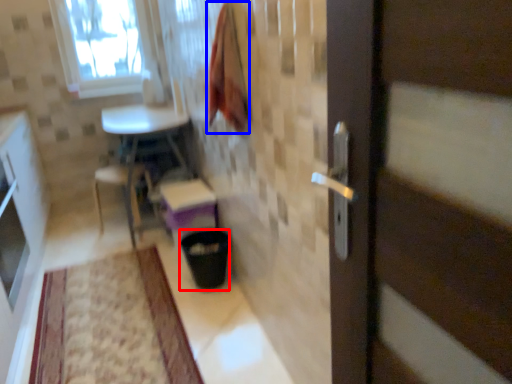
Question: Which object appears closest to the camera in this image, trash bin/can (highlighted by a red box) or blanket (highlighted by a blue box)?

Choices:
 (A) trash bin/can
 (B) blanket

Answer: (B)